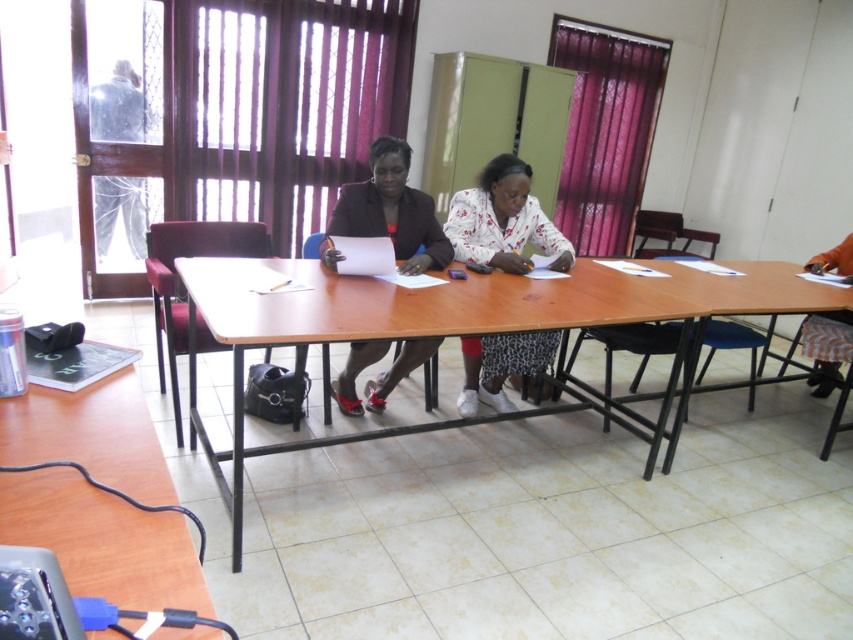
Consider the image. You are standing at the camera position and want to place a 24 inch wide laptop on the brown wooden table at lower left. Can the laptop fit on the table without overhanging the edges?

The distance between the brown wooden table at lower left and the camera is 31.07 inches. Since the laptop is only 24 inches wide, it can fit on the table as long as the table itself is at least 24 inches wide. However, the table width isn not provided in the description, so we cannot confirm if it will fit based on the given information.

You are standing at the entrance of the room and want to reach the brown wooden table at lower left. Which direction should you move towards?

The brown wooden table at lower left is located at point 0.773 on the x axis and 0.116 on the y axis, so you should move towards the lower left direction to reach it.